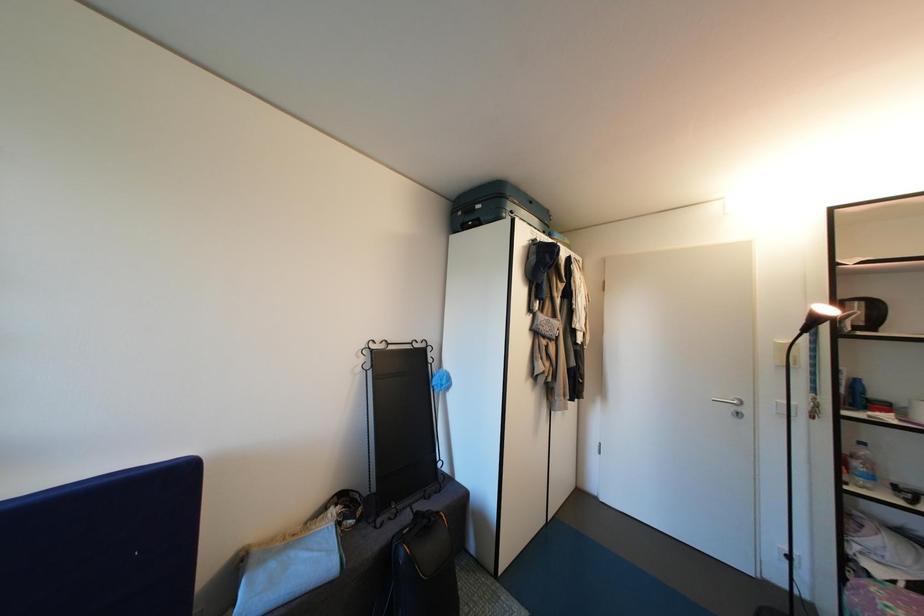
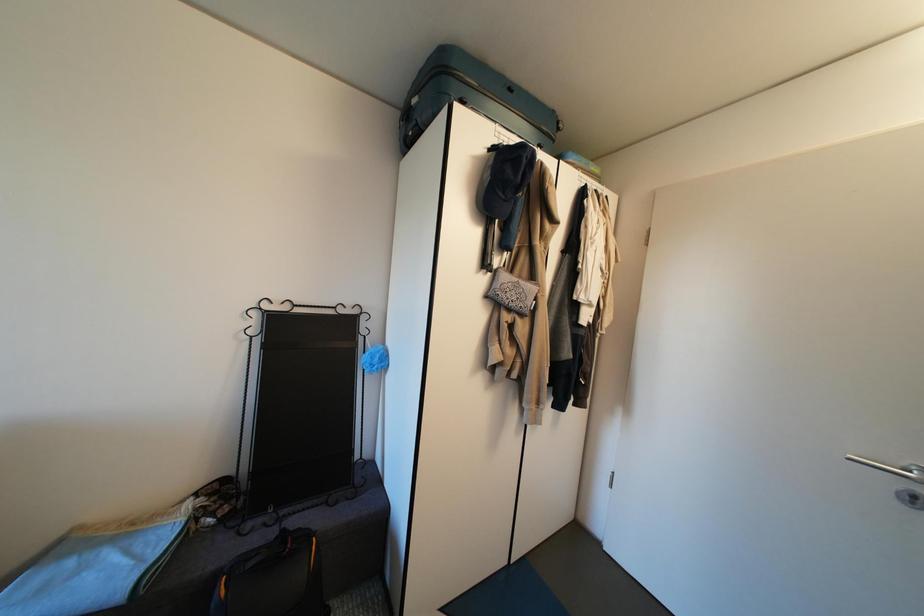
Question: The first image is from the beginning of the video and the second image is from the end. How did the camera likely rotate when shooting the video?

Choices:
 (A) Left
 (B) Right
 (C) Up
 (D) Down

Answer: (A)